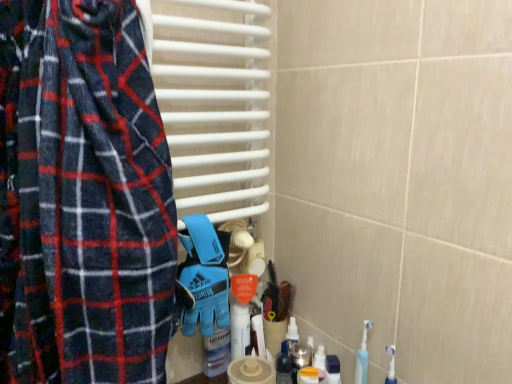
Question: Looking at their shapes, would you say white glossy bottle at center is wider or thinner than blue synthetic glove at center?

Choices:
 (A) wide
 (B) thin

Answer: (B)

Question: Looking at the image, does white glossy bottle at center seem bigger or smaller compared to blue synthetic glove at center?

Choices:
 (A) big
 (B) small

Answer: (B)

Question: Which object is positioned farthest from the white glossy bottle at center?

Choices:
 (A) translucent plastic bottle at lower center
 (B) blue synthetic glove at center

Answer: (B)

Question: Estimate the real-world distances between objects in this image. Which object is farther from the blue synthetic glove at center?

Choices:
 (A) white glossy bottle at center
 (B) translucent plastic bottle at lower center

Answer: (B)